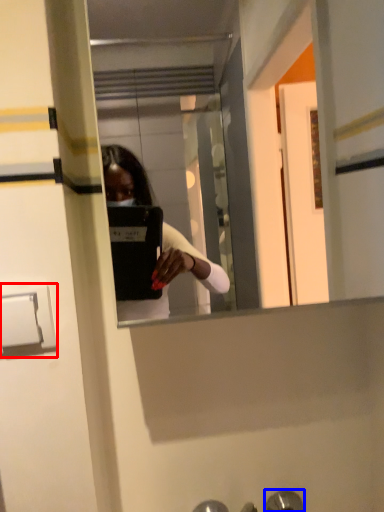
Question: Which of the following is the farthest to the observer, door handle (highlighted by a red box) or door handle (highlighted by a blue box)?

Choices:
 (A) door handle
 (B) door handle

Answer: (B)